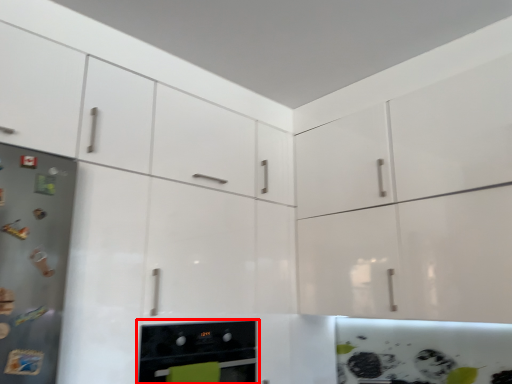
Question: From the image's perspective, what is the correct spatial positioning of home appliance (annotated by the red box) in reference to appliance?

Choices:
 (A) above
 (B) below

Answer: (B)